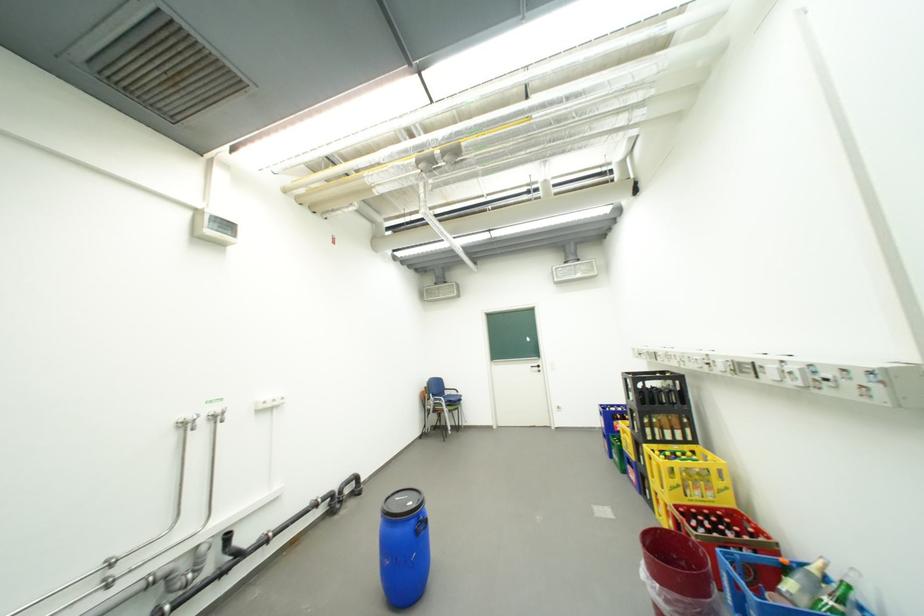
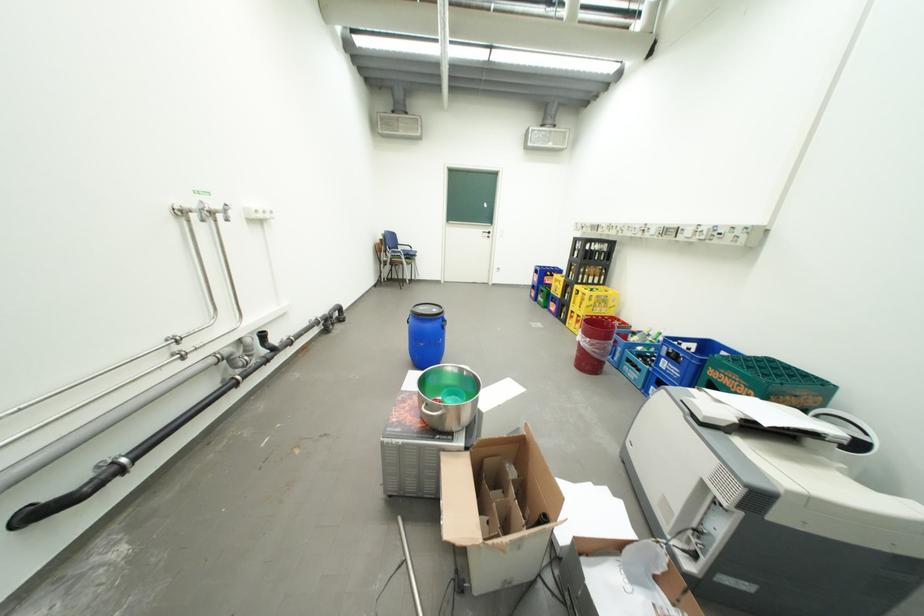
Locate, in the second image, the point that corresponds to [669,586] in the first image.

(599, 341)